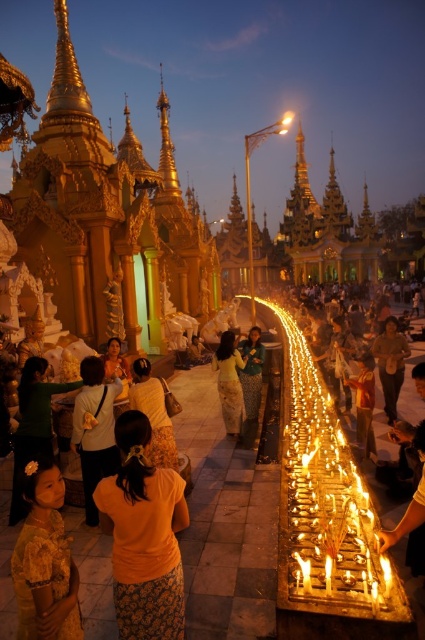
Question: Based on their relative distances, which object is farther from the orange floral skirt at center?

Choices:
 (A) matte green dress at lower left
 (B) matte green dress at center
 (C) orange fabric dress at center

Answer: (C)

Question: Is matte yellow dress at lower left positioned in front of brown leather jacket at center?

Choices:
 (A) yes
 (B) no

Answer: (A)

Question: Based on their relative distances, which object is nearer to the orange fabric dress at center?

Choices:
 (A) yellow fabric at center
 (B) matte green dress at lower left
 (C) orange floral skirt at center
 (D) matte green dress at center

Answer: (D)

Question: Is matte green dress at lower left bigger than yellow fabric at center?

Choices:
 (A) no
 (B) yes

Answer: (B)

Question: Is matte green dress at lower left bigger than yellow fabric at center?

Choices:
 (A) yes
 (B) no

Answer: (A)

Question: Which point is farther to the camera?

Choices:
 (A) matte green dress at center
 (B) brown leather jacket at center
 (C) orange floral skirt at center

Answer: (B)